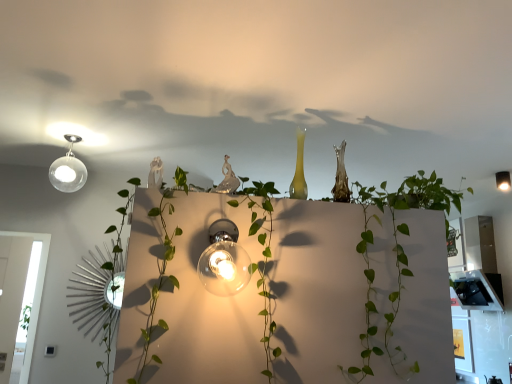
Question: Which direction should I rotate to look at translucent glass bulb at center, which appears as the 2th lamp when viewed from the top, — up or down?

Choices:
 (A) up
 (B) down

Answer: (B)

Question: Can you confirm if translucent glass bulb at center, arranged as the 2th lamp when viewed from the back, is shorter than matte glass bulb at upper right, the 1th lamp in the top-to-bottom sequence?

Choices:
 (A) no
 (B) yes

Answer: (A)

Question: Is translucent glass bulb at center, which appears as the 2th lamp when viewed from the top, at the right side of matte glass bulb at upper right, which is counted as the 2th lamp, starting from the front?

Choices:
 (A) yes
 (B) no

Answer: (B)

Question: From the image's perspective, is translucent glass bulb at center, arranged as the 2th lamp when viewed from the back, below matte glass bulb at upper right, marked as the 2th lamp in a left-to-right arrangement?

Choices:
 (A) no
 (B) yes

Answer: (B)

Question: From a real-world perspective, is translucent glass bulb at center, arranged as the 2th lamp when viewed from the back, beneath matte glass bulb at upper right, marked as the 2th lamp in a left-to-right arrangement?

Choices:
 (A) no
 (B) yes

Answer: (B)

Question: Can you confirm if translucent glass bulb at center, arranged as the 2th lamp when viewed from the back, is smaller than matte glass bulb at upper right, which is counted as the 2th lamp, starting from the front?

Choices:
 (A) no
 (B) yes

Answer: (A)

Question: Can you confirm if translucent glass bulb at center, the 1th lamp positioned from the front, is bigger than matte glass bulb at upper right, which appears as the 2th lamp when ordered from the bottom?

Choices:
 (A) yes
 (B) no

Answer: (A)

Question: Is matte glass bulb at upper right, the 1th lamp in the top-to-bottom sequence, taller than translucent glass bulb at center, which is the first lamp in bottom-to-top order?

Choices:
 (A) no
 (B) yes

Answer: (A)

Question: Does matte glass bulb at upper right, which is counted as the 2th lamp, starting from the front, have a lesser width compared to translucent glass bulb at center, which appears as the 2th lamp when viewed from the top?

Choices:
 (A) no
 (B) yes

Answer: (B)

Question: Is matte glass bulb at upper right, which ranks as the 1th lamp in back-to-front order, not inside translucent glass bulb at center, arranged as the 2th lamp when viewed from the back?

Choices:
 (A) no
 (B) yes

Answer: (B)

Question: From a real-world perspective, is matte glass bulb at upper right, marked as the 2th lamp in a left-to-right arrangement, positioned over translucent glass bulb at center, placed as the second lamp when sorted from right to left, based on gravity?

Choices:
 (A) yes
 (B) no

Answer: (A)

Question: Can you confirm if matte glass bulb at upper right, which is counted as the 2th lamp, starting from the front, is positioned to the left of translucent glass bulb at center, which is the first lamp in bottom-to-top order?

Choices:
 (A) yes
 (B) no

Answer: (B)

Question: Is matte glass bulb at upper right, which appears as the 2th lamp when ordered from the bottom, positioned before translucent glass bulb at center, which is the first lamp in bottom-to-top order?

Choices:
 (A) no
 (B) yes

Answer: (A)

Question: In terms of width, does translucent glass bulb at center, placed as the second lamp when sorted from right to left, look wider or thinner when compared to matte glass bulb at upper right, which is counted as the 2th lamp, starting from the front?

Choices:
 (A) thin
 (B) wide

Answer: (B)